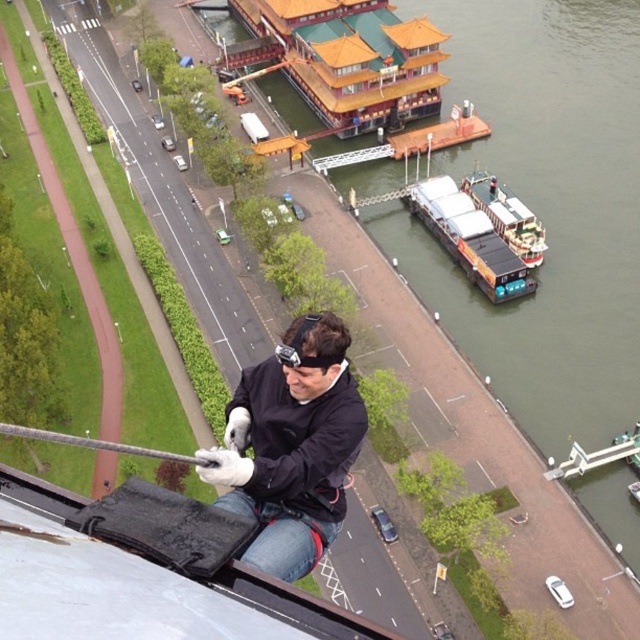
Question: Which object is closer to the camera taking this photo?

Choices:
 (A) black matte jacket at center
 (B) black matte goggles at center

Answer: (A)

Question: Among these objects, which one is farthest from the camera?

Choices:
 (A) yellow matte barge at right
 (B) black matte jacket at center
 (C) black matte goggles at center
 (D) white matte boat at center-right

Answer: (D)

Question: Can you confirm if yellow matte barge at right is thinner than white matte boat at center-right?

Choices:
 (A) yes
 (B) no

Answer: (B)

Question: Does white matte boat at center-right have a greater width compared to black matte goggles at center?

Choices:
 (A) yes
 (B) no

Answer: (A)

Question: Which object is positioned closest to the black matte jacket at center?

Choices:
 (A) white matte boat at center-right
 (B) black matte goggles at center

Answer: (B)

Question: Does yellow matte barge at right come in front of black matte goggles at center?

Choices:
 (A) yes
 (B) no

Answer: (B)